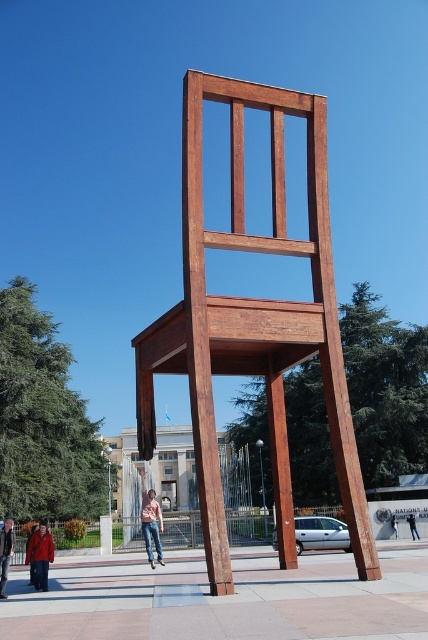
Question: Can you confirm if wooden chair at center is positioned to the left of denim jacket at lower left?

Choices:
 (A) yes
 (B) no

Answer: (B)

Question: Which point appears closest to the camera in this image?

Choices:
 (A) (143, 524)
 (B) (190, 150)
 (C) (5, 545)
 (D) (392, 524)

Answer: (B)

Question: Is wooden chair at center thinner than denim jacket at lower left?

Choices:
 (A) yes
 (B) no

Answer: (B)

Question: Which point is farther to the camera?

Choices:
 (A) (8, 534)
 (B) (415, 525)

Answer: (B)

Question: Which of these objects is positioned closest to the denim jacket at lower left?

Choices:
 (A) wooden chair at center
 (B) denim jacket at lower right
 (C) denim jeans at lower center

Answer: (C)

Question: Is denim jeans at lower center to the left of denim jacket at lower left from the viewer's perspective?

Choices:
 (A) no
 (B) yes

Answer: (A)